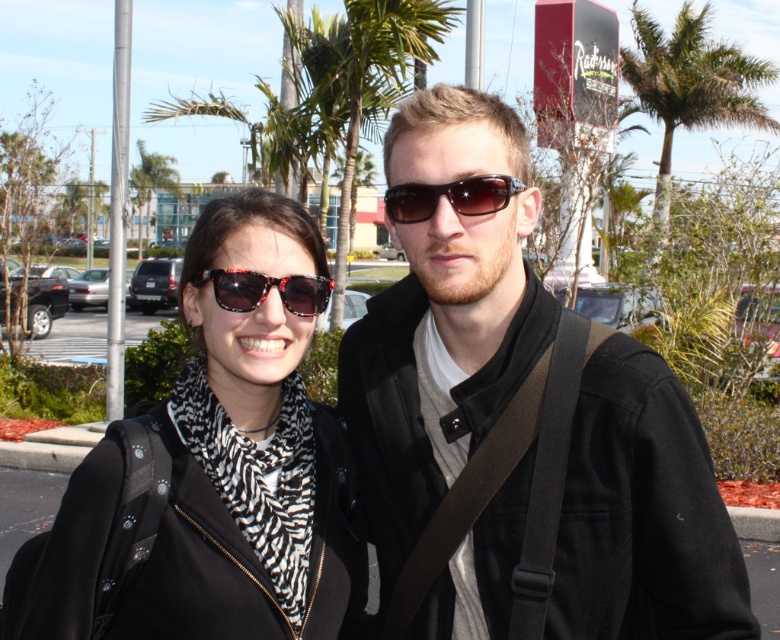
You are a photographer trying to capture a photo of the green leafy palm tree at upper center and the shiny black sunglasses at center. From the photographer perspective, which object is positioned to the right?

The green leafy palm tree at upper center is positioned to the right of the shiny black sunglasses at center.

You are standing at the point marked as point (493, 202) in the parking lot. You want to walk directly to the building with the red sign. Which direction should you go?

The point (493, 202) is 6.15 feet away from the viewer. To reach the building with the red sign, you should walk towards the direction where the building is located, which is behind the two individuals in the parking lot.

You are a customer at a sunglasses store and see two pairs displayed at the center of the store. The first pair is labeled as black plastic sunglasses at center, and the second is shiny black sunglasses at center. The store manager tells you that one of them is placed higher on the display. Which pair is positioned higher?

The black plastic sunglasses at center is located above the shiny black sunglasses at center, so the black plastic sunglasses at center is positioned higher.